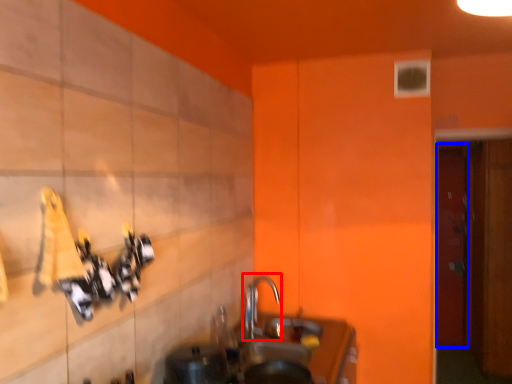
Question: Which of the following is the closest to the observer, tap (highlighted by a red box) or door (highlighted by a blue box)?

Choices:
 (A) tap
 (B) door

Answer: (A)